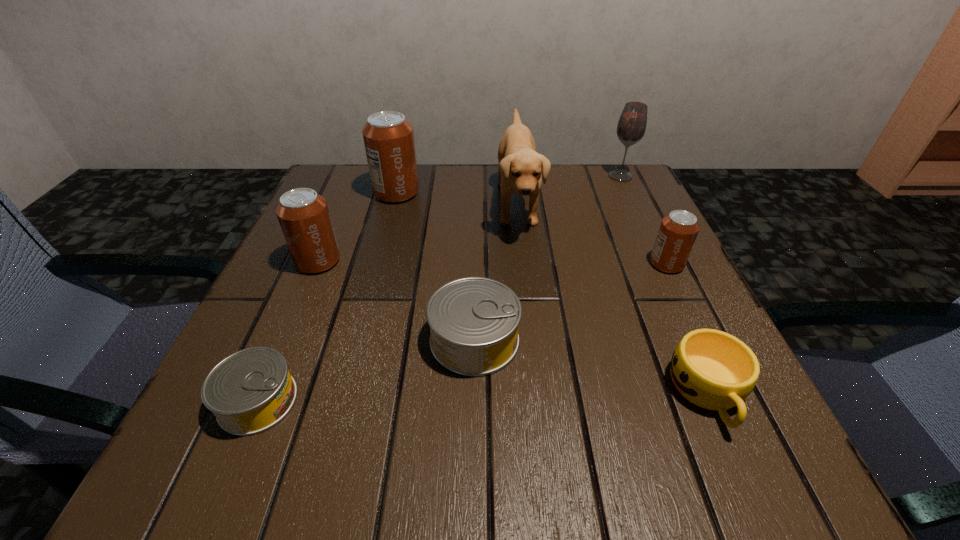
Locate an element on the screen. Image resolution: width=960 pixels, height=540 pixels. vacant space located on the back of the right silver can is located at coordinates (476, 218).

The height and width of the screenshot is (540, 960). Identify the location of vacant space located 0.300m on the left of the cup. (462, 394).

The height and width of the screenshot is (540, 960). Identify the location of vacant point located 0.110m on the back of the smaller silver can. (294, 316).

At what (x,y) coordinates should I click in order to perform the action: click on puppy at the far edge. Please return your answer as a coordinate pair (x, y). The width and height of the screenshot is (960, 540). Looking at the image, I should click on (521, 168).

Identify the location of can located in the far edge section of the desktop. (388, 137).

This screenshot has height=540, width=960. Find the location of `glass drink container that is at the far edge`. glass drink container that is at the far edge is located at coordinates (631, 127).

Where is `cup at the near edge`? cup at the near edge is located at coordinates (712, 369).

Identify the location of can that is positioned at the near edge. (250, 391).

Locate an element on the screen. Image resolution: width=960 pixels, height=540 pixels. glass drink container that is at the right edge is located at coordinates (631, 127).

Where is `can that is positioned at the right edge`? can that is positioned at the right edge is located at coordinates (678, 231).